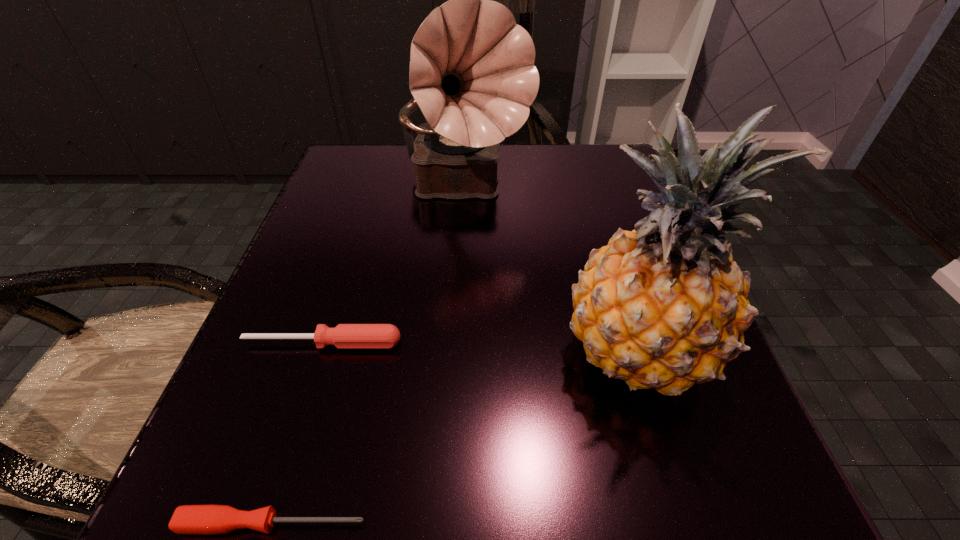
Where is `the farthest object`? The image size is (960, 540). the farthest object is located at coordinates (472, 74).

The image size is (960, 540). Find the location of `the rightmost object`. the rightmost object is located at coordinates (664, 306).

Locate an element on the screen. The width and height of the screenshot is (960, 540). the taller screwdriver is located at coordinates (344, 336).

You are a GUI agent. You are given a task and a screenshot of the screen. Output one action in this format:
    pyautogui.click(x=<x>, y=<y>)
    Task: Click on the farther screwdriver
    
    Given the screenshot: What is the action you would take?
    pyautogui.click(x=344, y=336)

Where is `the nearer screwdriver`? the nearer screwdriver is located at coordinates (188, 519).

Where is `the shortest object`? The height and width of the screenshot is (540, 960). the shortest object is located at coordinates (188, 519).

Find the location of a particular element. Image resolution: width=960 pixels, height=540 pixels. free space located 0.180m from the horn of the record player is located at coordinates (459, 300).

The image size is (960, 540). I want to click on vacant space located 0.220m on the back of the rightmost object, so click(x=593, y=211).

This screenshot has height=540, width=960. I want to click on vacant point located 0.150m on the right of the farther screwdriver, so click(507, 343).

Identify the location of free space located 0.320m at the tip of the nearest object. Image resolution: width=960 pixels, height=540 pixels. (673, 524).